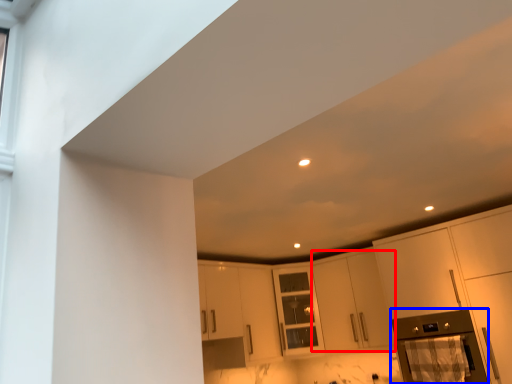
Question: Which object appears farthest to the camera in this image, cabinetry (highlighted by a red box) or appliance (highlighted by a blue box)?

Choices:
 (A) cabinetry
 (B) appliance

Answer: (A)